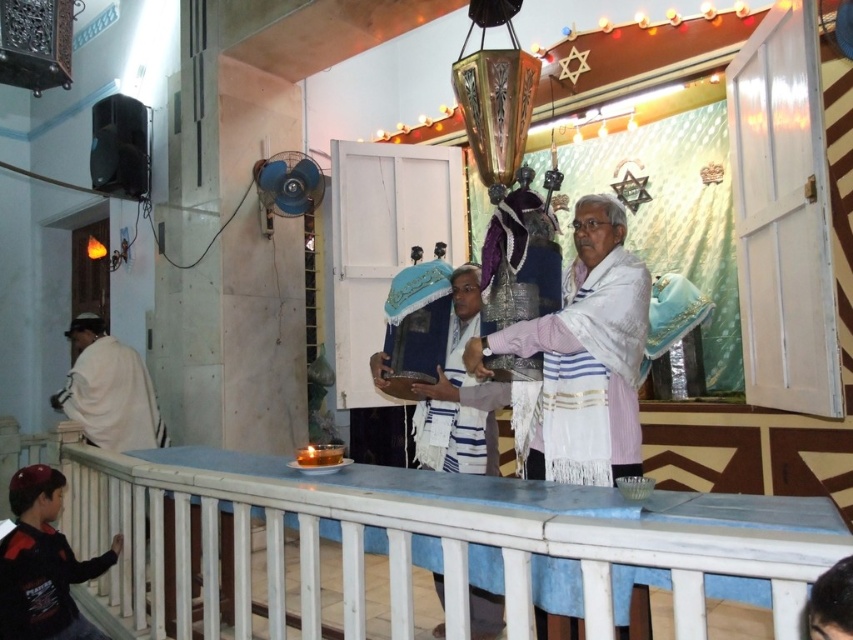
You are an interior designer planning to install a new lighting fixture in the synagogue. You need to ensure it won not block the view of both the white textured robe at center and the white cloth at left. Given their heights, which object might require a lower hanging fixture to avoid obstruction?

The white textured robe at center has a lesser height compared to white cloth at left, so the lower hanging fixture should be positioned to accommodate the shorter white textured robe at center while still allowing visibility of the taller white cloth at left.

You are standing at point (131,388) and want to reach the Torah scroll. The minimum distance you can move is 4 meters. Can you reach the Torah scroll without moving more than 4 meters?

The distance between you and the Torah scroll is 4.71 meters, which exceeds the minimum distance of 4 meters you can move. Therefore, you cannot reach the Torah scroll without moving more than 4 meters.

You are an interior designer asked to rearrange the items in the synagogue scene. The client wants the white cloth at left and the dark blue fabric robe at lower left to be placed closer together. Based on their current positions, which item should you move to the right to achieve this?

To place the white cloth at left and the dark blue fabric robe at lower left closer together, you should move the dark blue fabric robe at lower left to the right since the white cloth at left is already positioned to the left of it. This will bring them nearer without needing to adjust the white cloth.